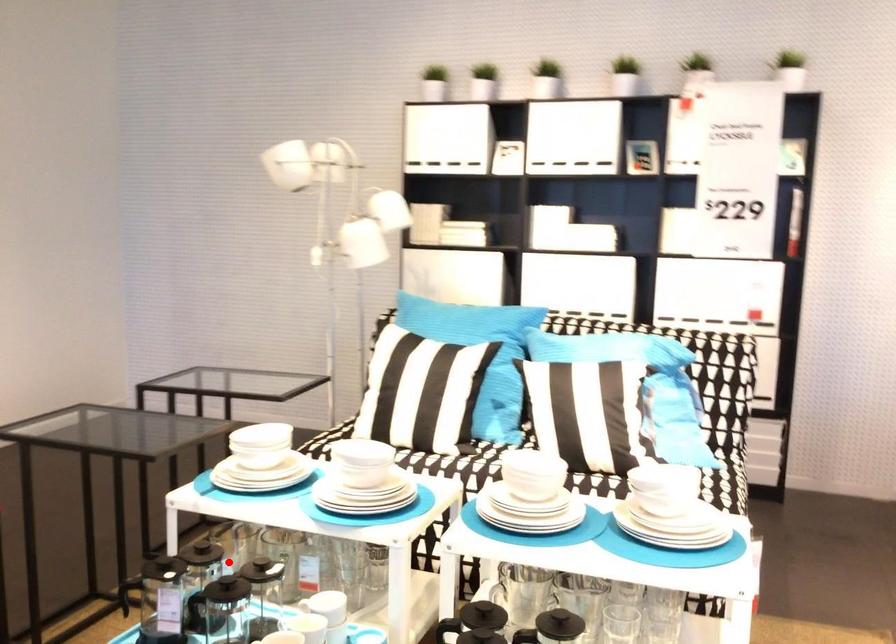
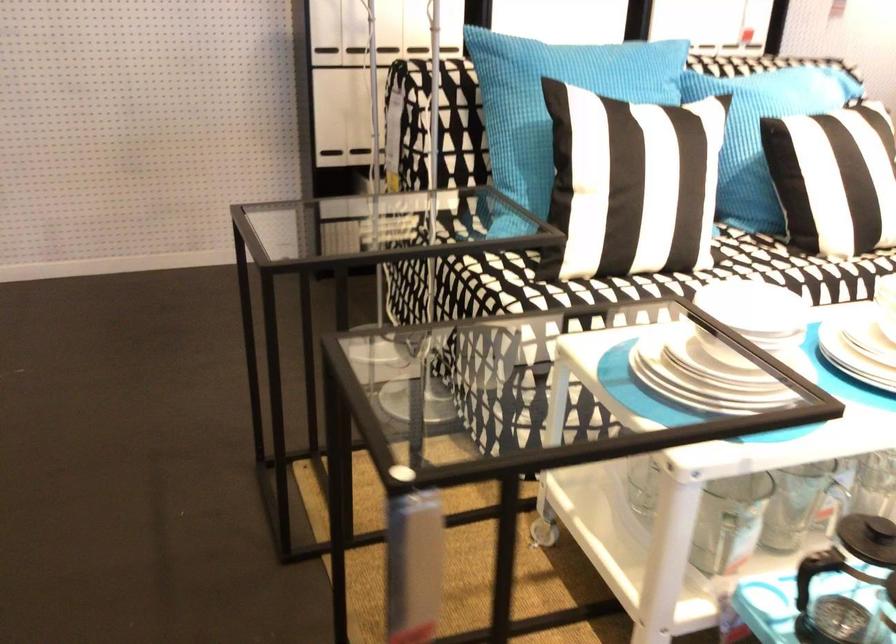
Question: I am providing you with two images of the same scene from different viewpoints. Image1 has a red point marked. In image2, the corresponding 3D location appears at what relative position? Reply with the corresponding letter.

Choices:
 (A) Closer
 (B) Farther

Answer: (A)